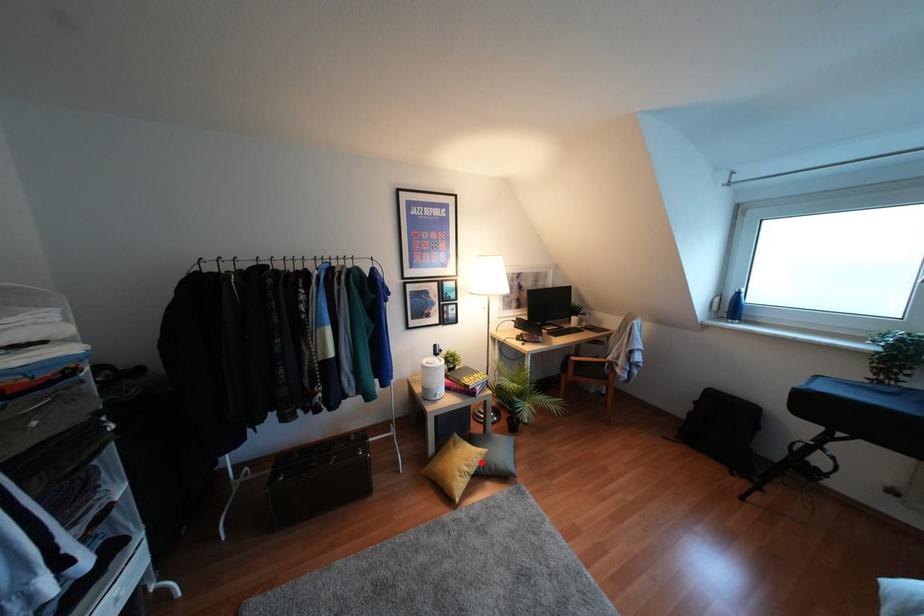
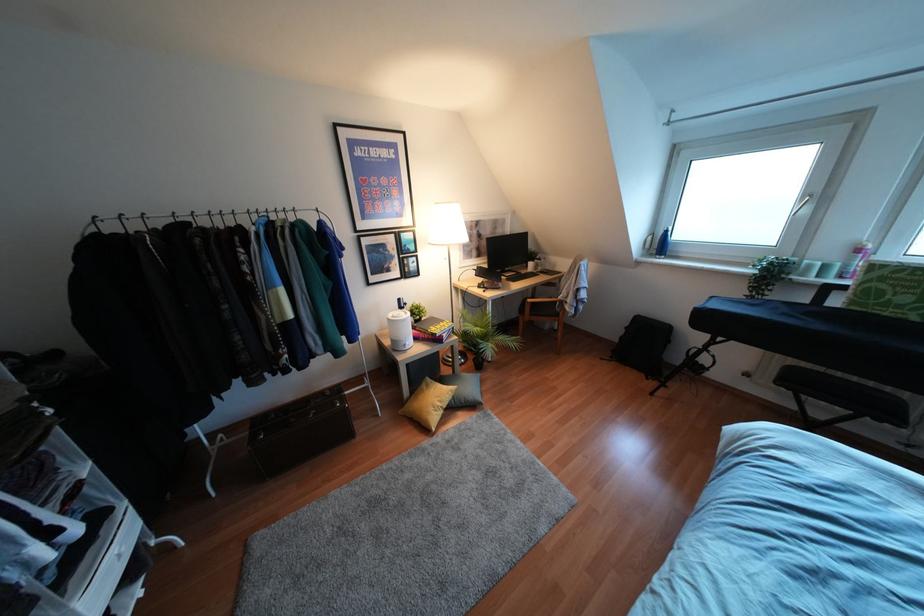
Question: I am providing you with two images of the same scene from different viewpoints. Image1 has a red point marked. In image2, the corresponding 3D location appears at what relative position? Reply with the corresponding letter.

Choices:
 (A) Closer
 (B) Farther

Answer: (B)